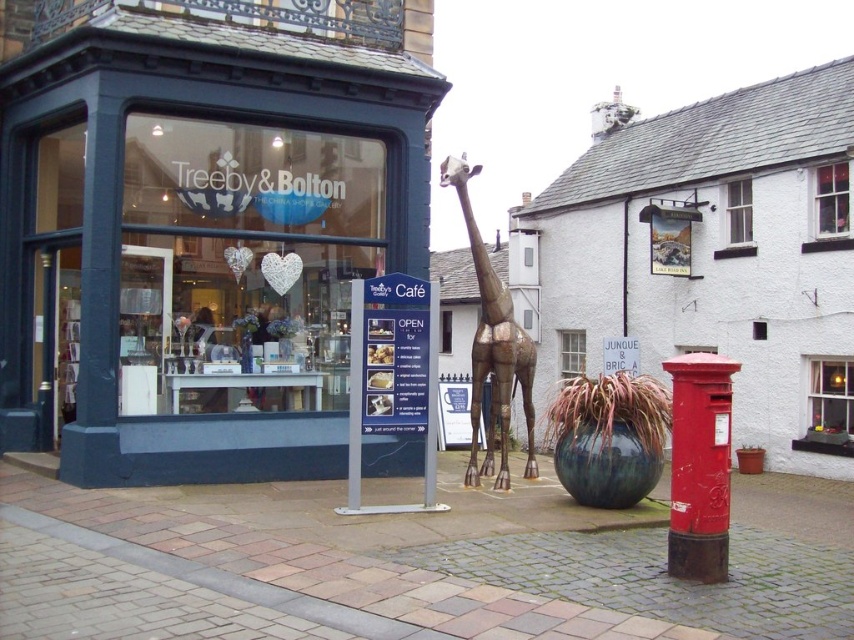
Question: Is metallic red postbox at center above matte glass shop window at center?

Choices:
 (A) no
 (B) yes

Answer: (B)

Question: Can you confirm if metallic red postbox at center is positioned to the right of metallic gold giraffe at center?

Choices:
 (A) no
 (B) yes

Answer: (B)

Question: Which point is closer to the camera?

Choices:
 (A) (624, 214)
 (B) (16, 310)
 (C) (276, 285)

Answer: (C)

Question: Which point appears farthest from the camera in this image?

Choices:
 (A) (156, 248)
 (B) (507, 365)
 (C) (775, 115)

Answer: (C)

Question: Which of the following is the closest to the observer?

Choices:
 (A) (560, 224)
 (B) (37, 36)
 (C) (492, 355)
 (D) (313, 369)

Answer: (C)

Question: Is matte blue storefront at center to the right of metallic gold giraffe at center from the viewer's perspective?

Choices:
 (A) no
 (B) yes

Answer: (A)